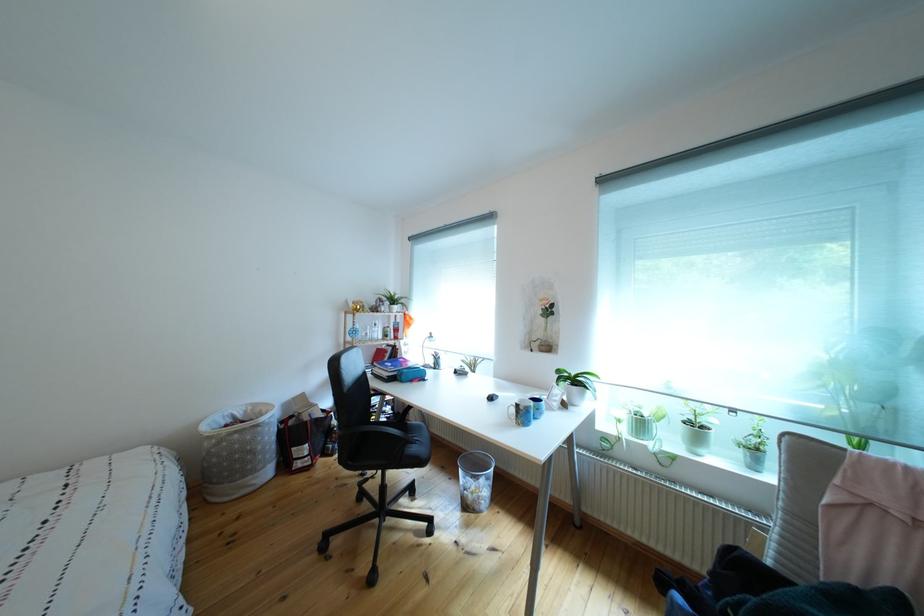
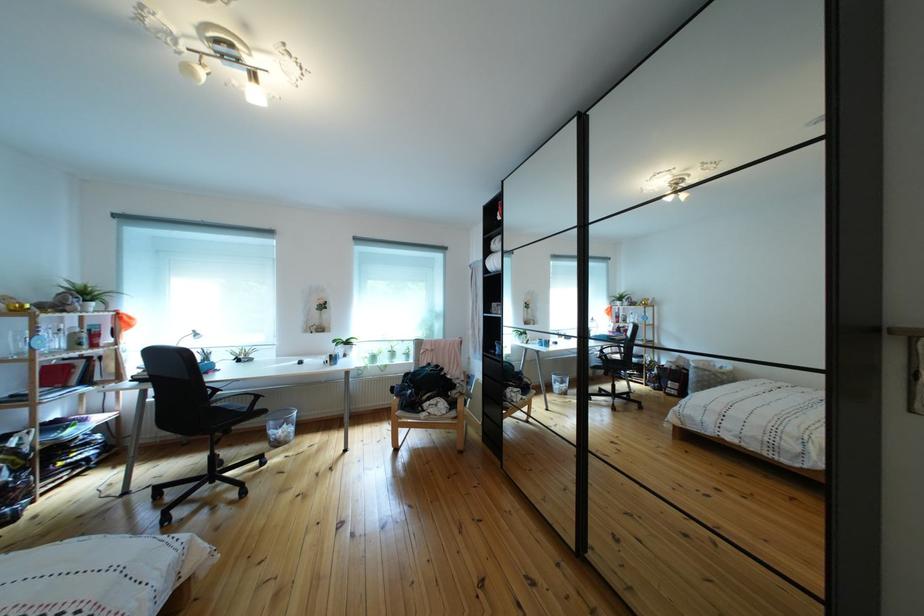
Locate, in the second image, the point that corresponds to the point at 472,477 in the first image.

(283, 430)